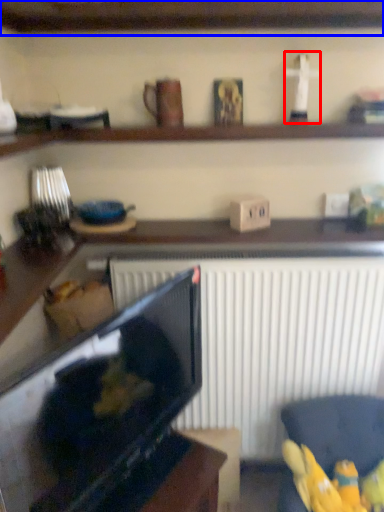
Question: Among these objects, which one is nearest to the camera, toy (highlighted by a red box) or shelf (highlighted by a blue box)?

Choices:
 (A) toy
 (B) shelf

Answer: (B)